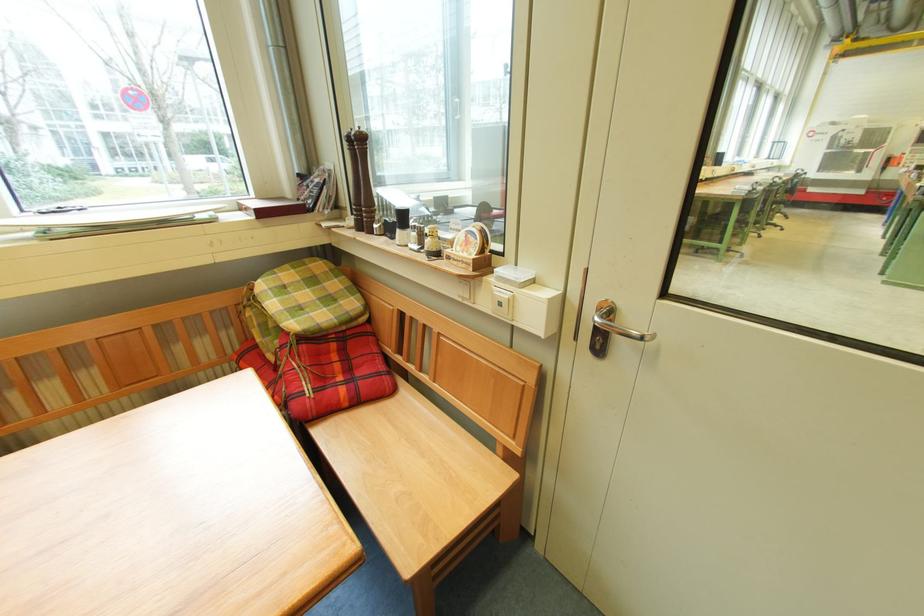
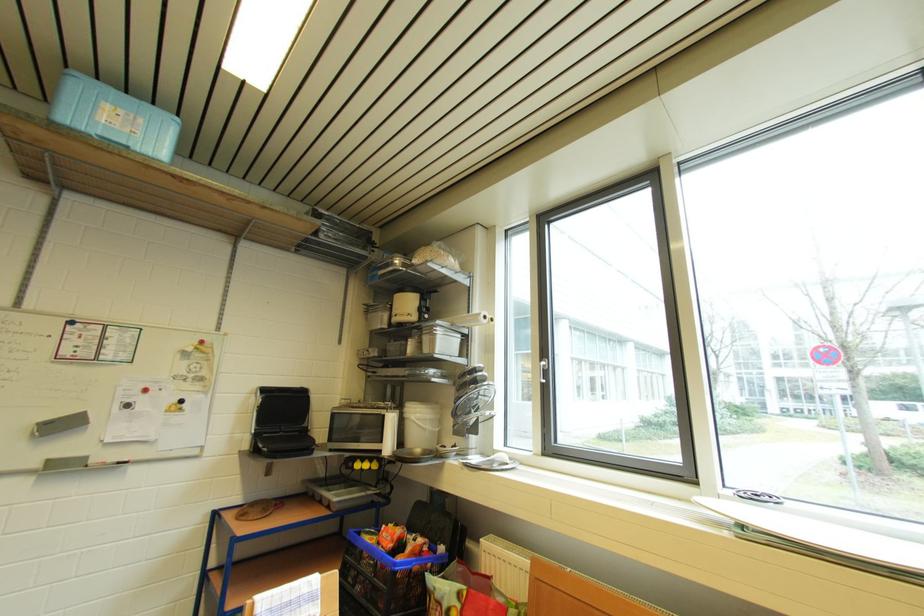
Question: The camera is either moving clockwise (left) or counter-clockwise (right) around the object. The first image is from the beginning of the video and the second image is from the end. Is the camera moving left or right when shooting the video?

Choices:
 (A) Left
 (B) Right

Answer: (B)